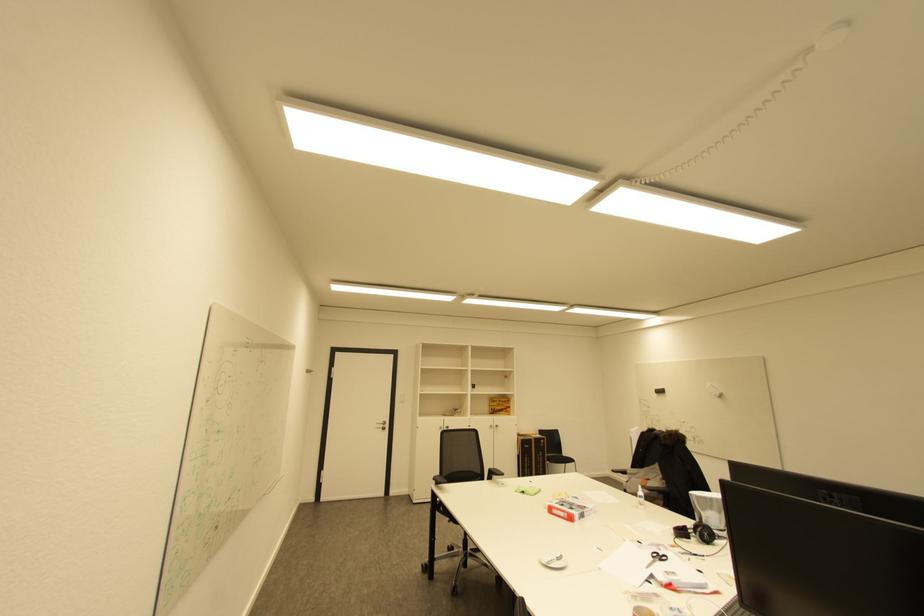
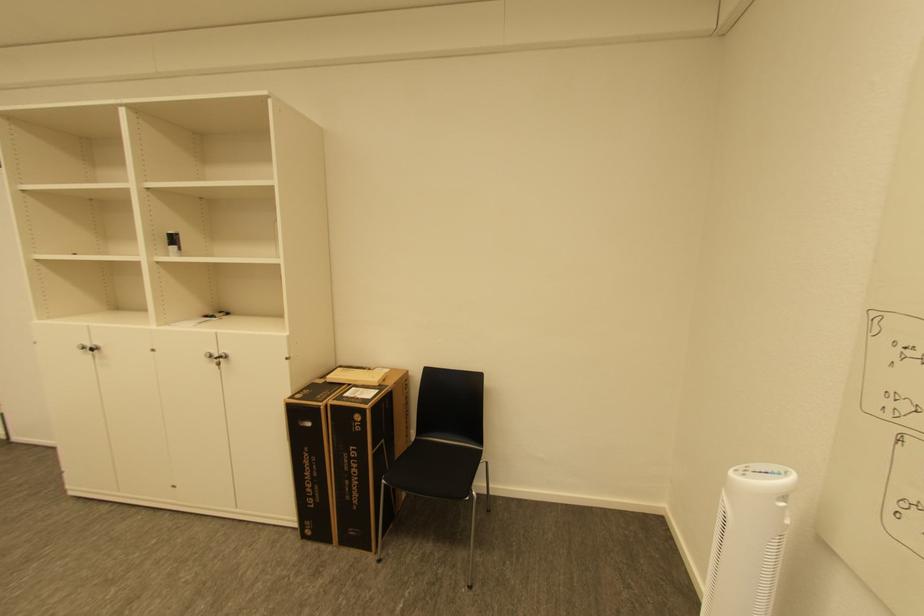
In the second image, find the point that corresponds to (x=548, y=442) in the first image.

(363, 418)